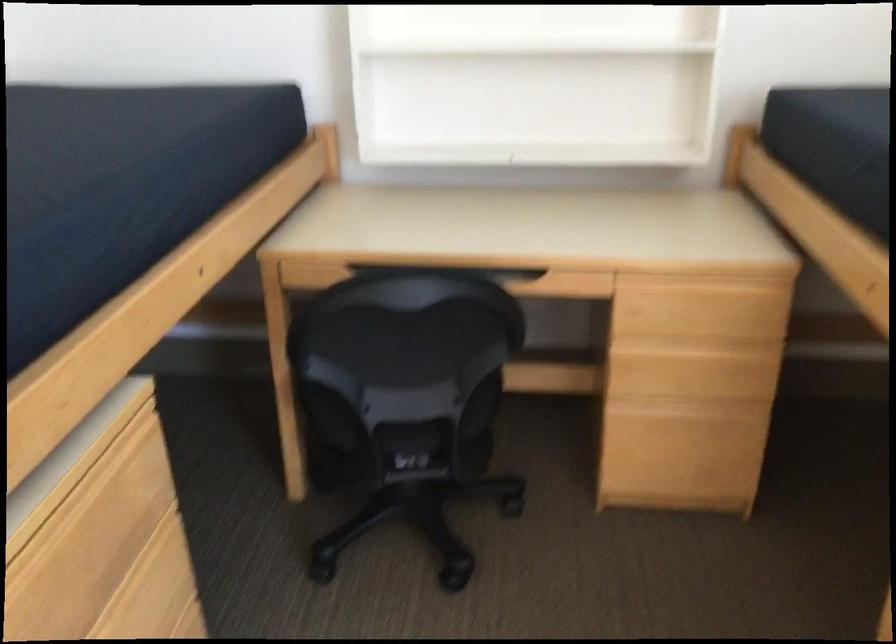
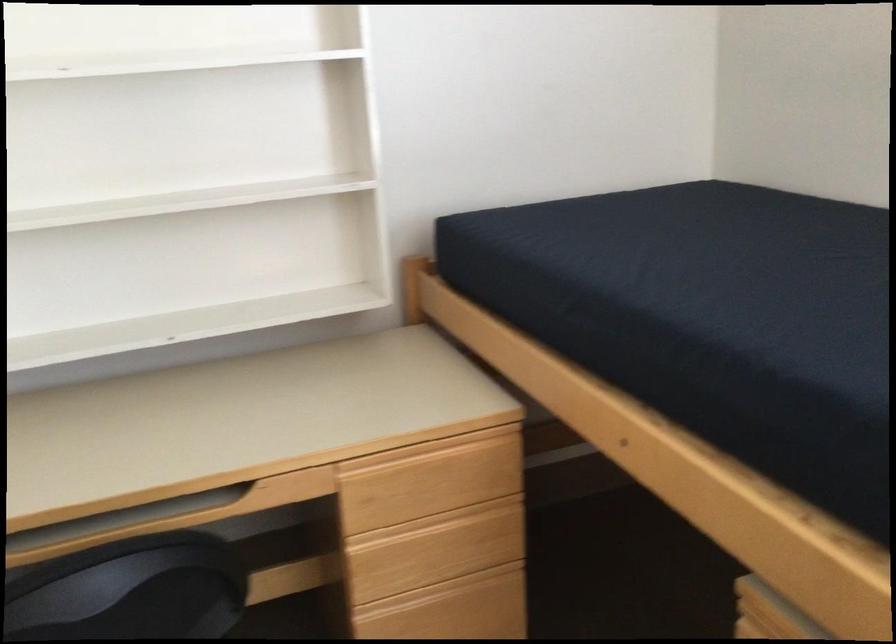
Question: The camera is either moving clockwise (left) or counter-clockwise (right) around the object. The first image is from the beginning of the video and the second image is from the end. Is the camera moving left or right when shooting the video?

Choices:
 (A) Left
 (B) Right

Answer: (A)